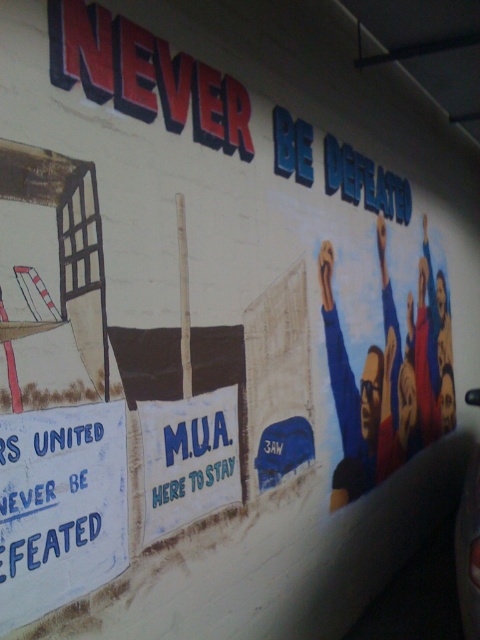
You are standing in front of the mural described. You want to touch the blue painted sign at lower left without moving your feet. Can you reach it if your arm can extend 1.35 meters?

The blue painted sign at lower left is 1.40 meters away from the viewer. Since your arm can only extend 1.35 meters, you cannot reach it without moving your feet.

You are standing in front of the mural described. There is a point marked at coordinates [59,502]. What object is located at this point?

The point at coordinates [59,502] indicates the blue painted sign at lower left.